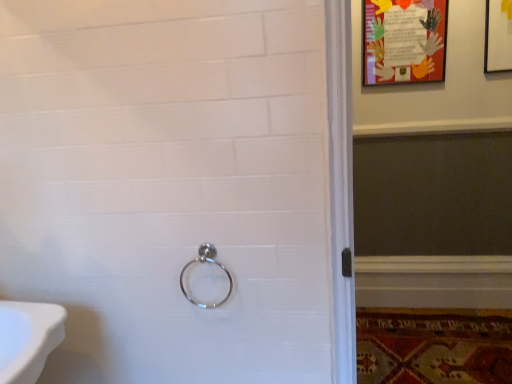
Question: Does polished metal ring at center have a lesser width compared to colorful paper poster at upper right?

Choices:
 (A) no
 (B) yes

Answer: (A)

Question: Does polished metal ring at center contain colorful paper poster at upper right?

Choices:
 (A) yes
 (B) no

Answer: (B)

Question: Considering the relative positions of polished metal ring at center and colorful paper poster at upper right in the image provided, is polished metal ring at center to the left of colorful paper poster at upper right from the viewer's perspective?

Choices:
 (A) yes
 (B) no

Answer: (A)

Question: Are polished metal ring at center and colorful paper poster at upper right located far from each other?

Choices:
 (A) yes
 (B) no

Answer: (A)

Question: From the image's perspective, is polished metal ring at center located beneath colorful paper poster at upper right?

Choices:
 (A) no
 (B) yes

Answer: (B)

Question: Is polished metal ring at center completely or partially outside of colorful paper poster at upper right?

Choices:
 (A) no
 (B) yes

Answer: (B)

Question: Is carpeted mat at lower right wider than colorful paper poster at upper right?

Choices:
 (A) yes
 (B) no

Answer: (A)

Question: Is there a large distance between carpeted mat at lower right and colorful paper poster at upper right?

Choices:
 (A) no
 (B) yes

Answer: (B)

Question: Does carpeted mat at lower right appear on the right side of colorful paper poster at upper right?

Choices:
 (A) yes
 (B) no

Answer: (A)

Question: Is carpeted mat at lower right directly adjacent to colorful paper poster at upper right?

Choices:
 (A) no
 (B) yes

Answer: (A)

Question: Considering the relative sizes of carpeted mat at lower right and colorful paper poster at upper right in the image provided, is carpeted mat at lower right taller than colorful paper poster at upper right?

Choices:
 (A) yes
 (B) no

Answer: (B)

Question: From a real-world perspective, does carpeted mat at lower right sit lower than colorful paper poster at upper right?

Choices:
 (A) yes
 (B) no

Answer: (A)

Question: Is carpeted mat at lower right inside colorful paper poster at upper right?

Choices:
 (A) no
 (B) yes

Answer: (A)